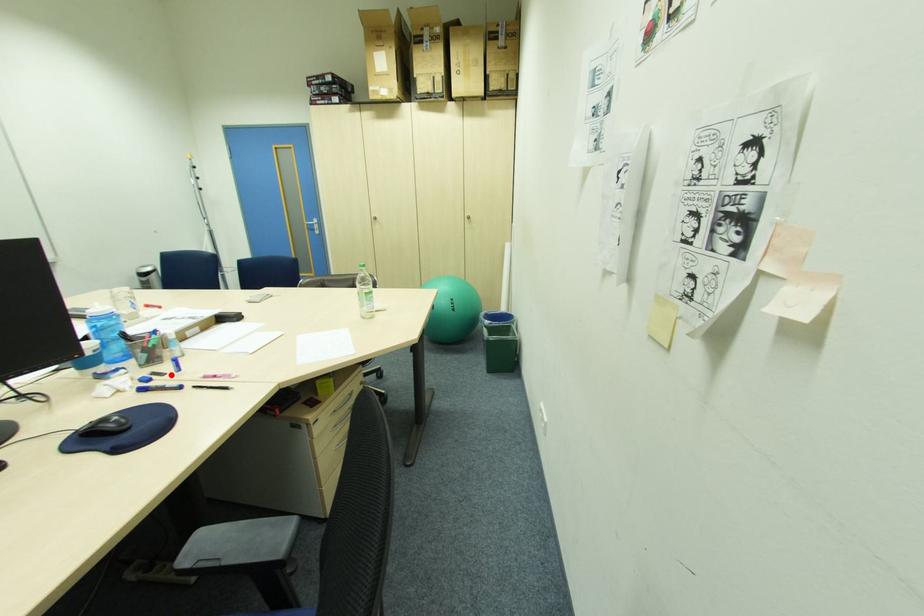
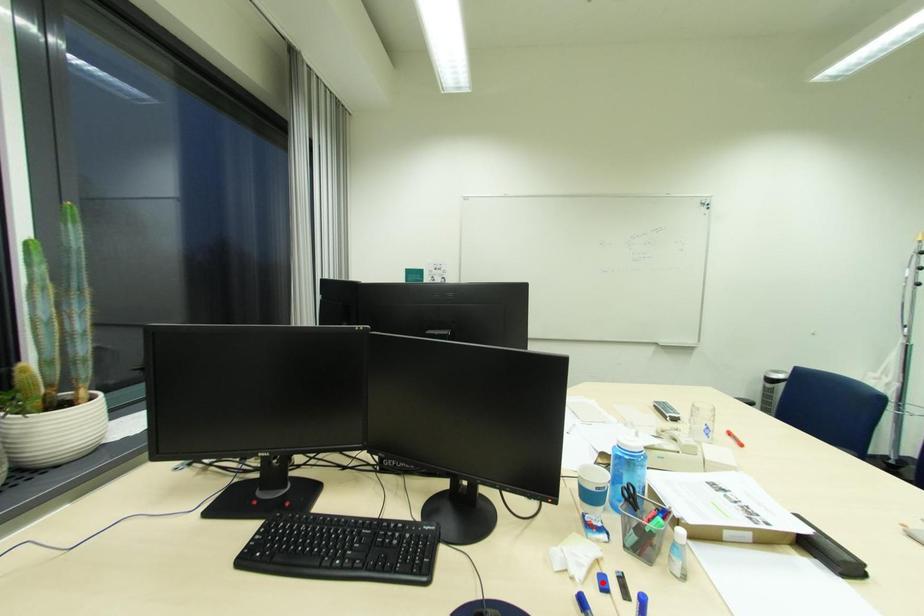
I am providing you with two images of the same scene from different viewpoints. A red point is marked on the first image and another point is marked on the second image. Does the point marked in image1 correspond to the same location as the one in image2?

No